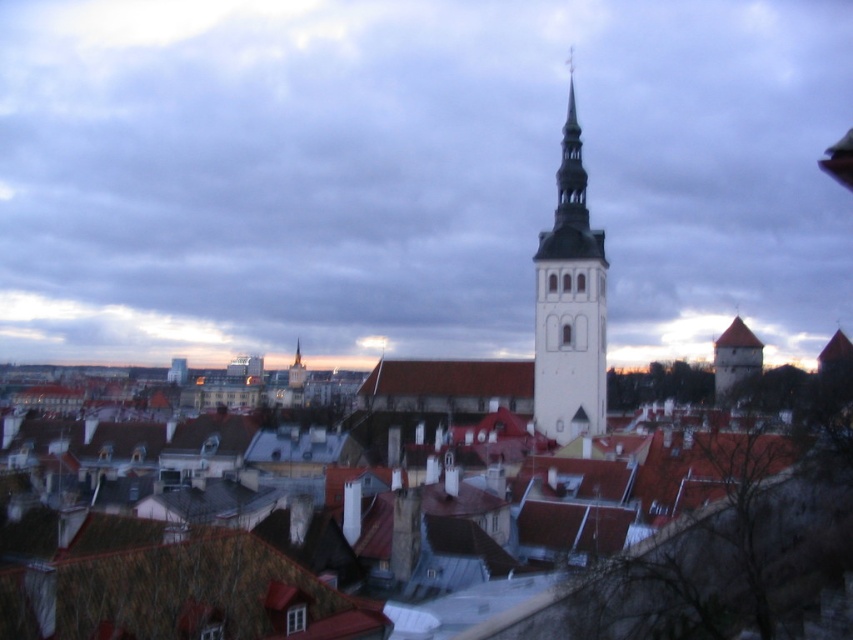
You are standing in the historic cityscape and want to take a photo. You notice two points in the scene labeled as point 1 at coordinates (271, 563) and point 2 at coordinates (554, 320). Which point is closer to your current position?

Point 1 at coordinates (271, 563) is closer to your current position because it is closer to the camera than point 2 at coordinates (554, 320).

You are an architect analyzing the city layout. Based on the coordinates provided, where is the matte white tower at center located in the image?

The matte white tower at center is located at coordinates point (413,176).

You are an architect analyzing the cityscape. Based on the scene, which object is shorter between the brown tile roof at center and the brown stone tower at right?

The brown tile roof at center is shorter than the brown stone tower at right.